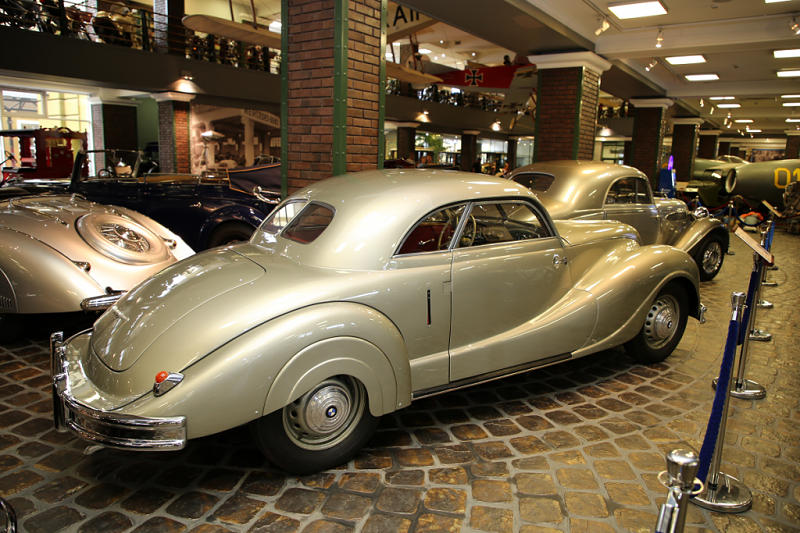
The height and width of the screenshot is (533, 800). What are the coordinates of `grey grit between tiles` in the screenshot? It's located at (476, 502), (518, 467), (532, 431), (638, 451).